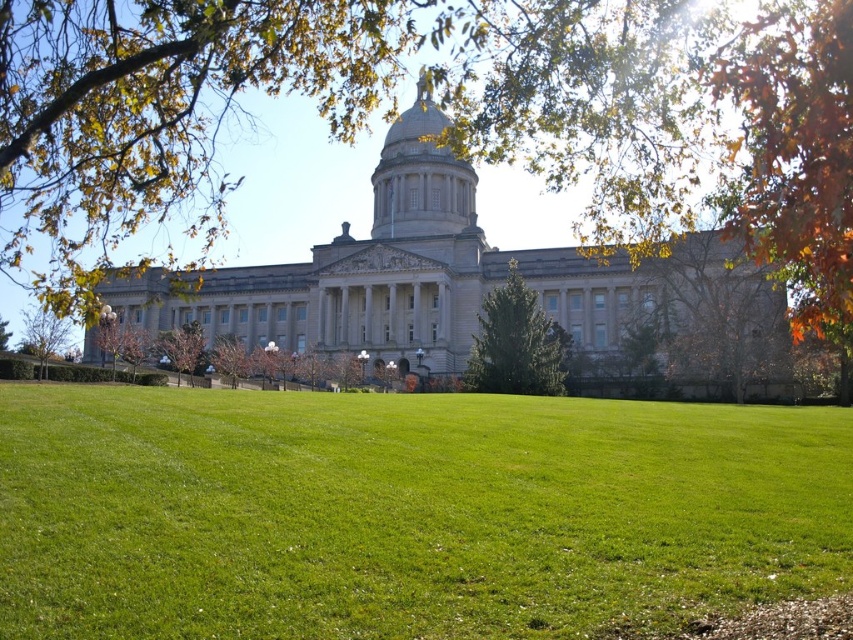
Is green smooth grass at center wider than green leafy tree at center?

Indeed, green smooth grass at center has a greater width compared to green leafy tree at center.

Is green smooth grass at center closer to the viewer compared to green leafy tree at center?

That is True.

Does point (297, 396) come farther from viewer compared to point (218, 356)?

No, it is not.

Where is `green smooth grass at center`? The image size is (853, 640). green smooth grass at center is located at coordinates (405, 513).

Between green smooth grass at center and green textured tree at center, which one has less height?

green smooth grass at center

The image size is (853, 640). What do you see at coordinates (405, 513) in the screenshot?
I see `green smooth grass at center` at bounding box center [405, 513].

The height and width of the screenshot is (640, 853). In order to click on green smooth grass at center in this screenshot , I will do `click(405, 513)`.

Which is more to the right, green leafy tree at left or green leafy tree at center?

From the viewer's perspective, green leafy tree at center appears more on the right side.

Can you confirm if green leafy tree at left is positioned above green leafy tree at center?

Correct, green leafy tree at left is located above green leafy tree at center.

This screenshot has height=640, width=853. What do you see at coordinates (44, 333) in the screenshot? I see `green leafy tree at left` at bounding box center [44, 333].

Locate an element on the screen. This screenshot has height=640, width=853. green leafy tree at left is located at coordinates (44, 333).